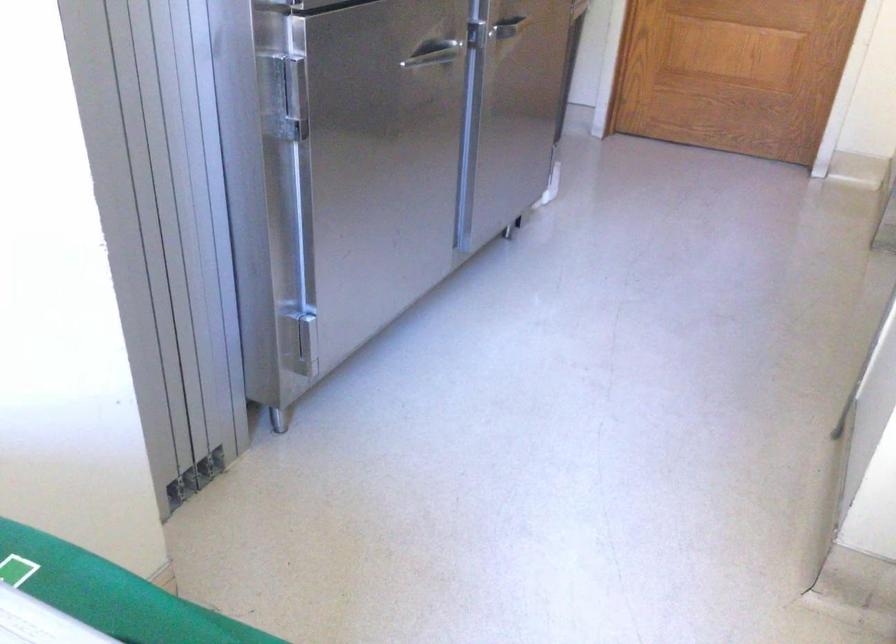
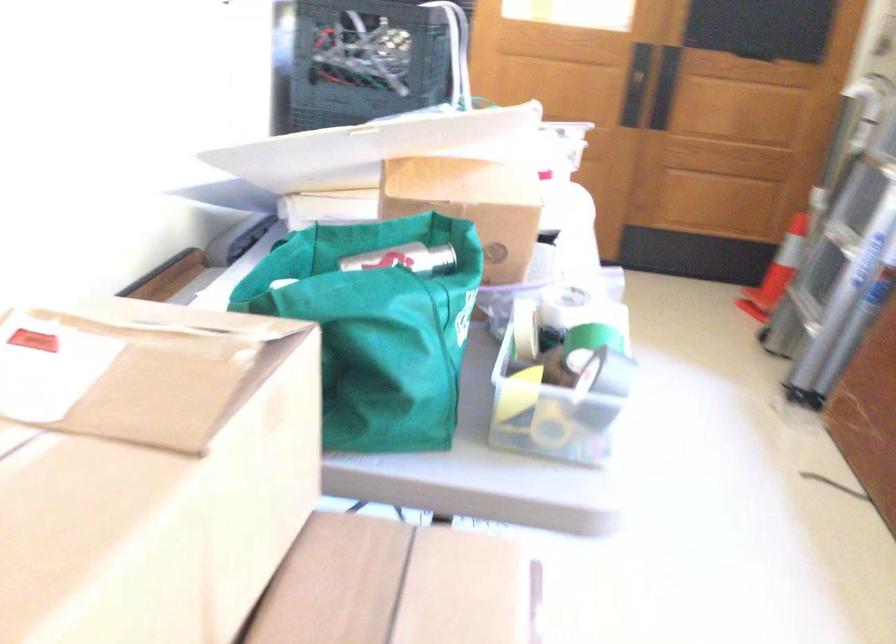
First-person continuous shooting, in which direction is the camera rotating?

The camera rotated toward right-down.